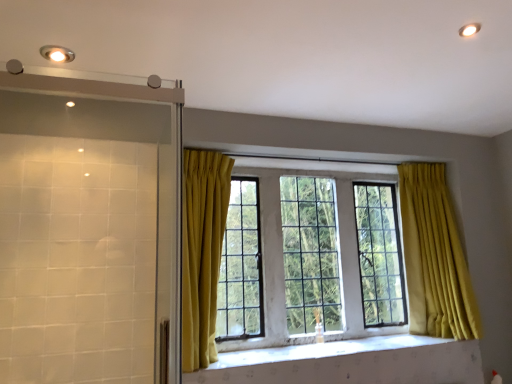
I want to click on free space between white glossy light fixture at upper right and matte silver light fixture at upper left, so click(289, 41).